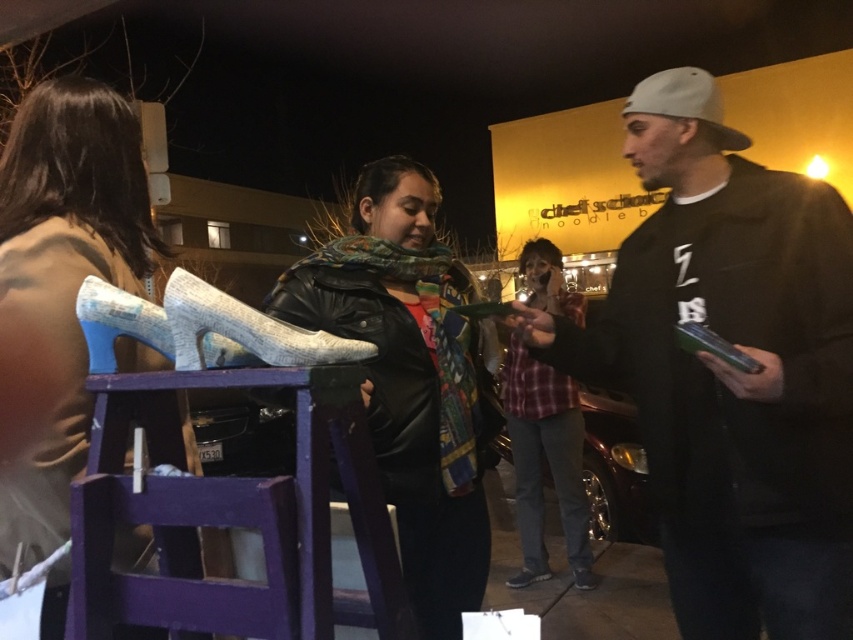
Between point (36, 314) and point (637, 97), which one is positioned in front?

Point (36, 314)

Identify the location of matte white high-heels at left. The width and height of the screenshot is (853, 640). (65, 272).

Who is taller, leather jacket at center or plaid fabric shirt at center?

With more height is leather jacket at center.

Is point (433, 305) more distant than point (573, 298)?

No.

Identify the location of leather jacket at center. This screenshot has width=853, height=640. (410, 378).

Measure the distance between point [460,337] and camera.

Point [460,337] and camera are 6.27 feet apart.

Who is more forward, (378, 196) or (587, 580)?

Point (378, 196)

Find the location of a particular element. The image size is (853, 640). leather jacket at center is located at coordinates (410, 378).